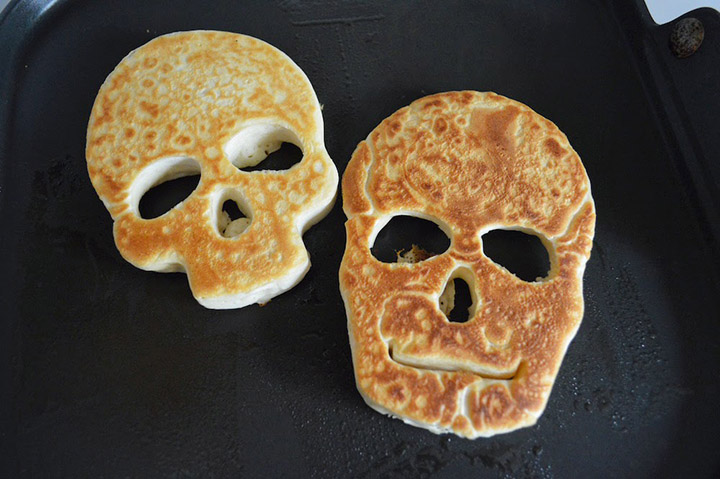
Find the location of `bottom left corner empty space`. bottom left corner empty space is located at coordinates (6, 475).